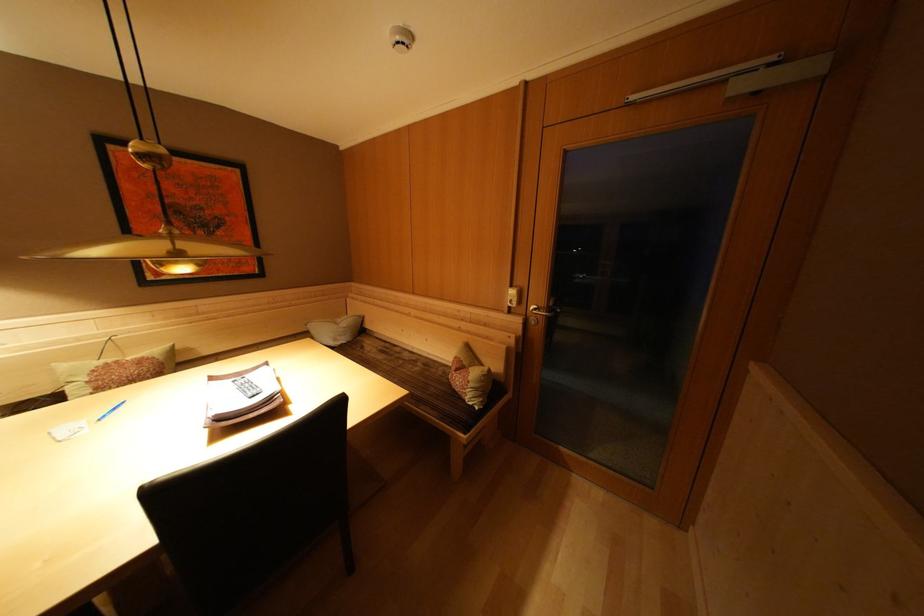
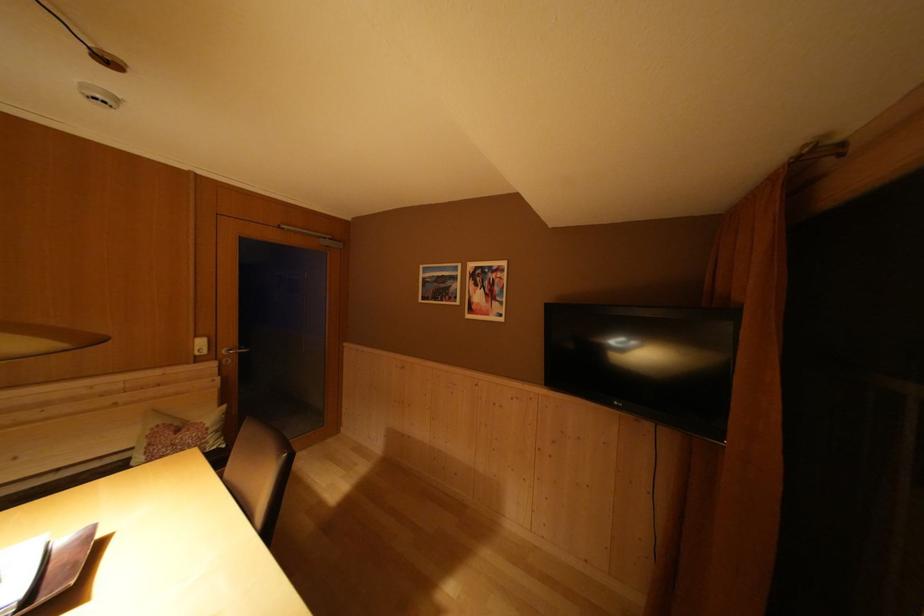
In the second image, find the point that corresponds to pixel 532 329 in the first image.

(226, 371)